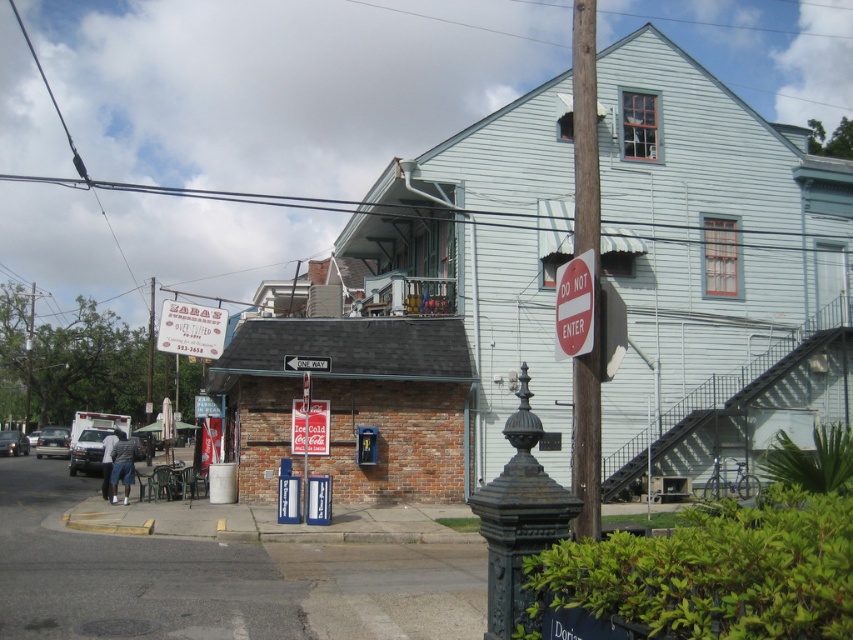
Question: Which of the following is the closest to the observer?

Choices:
 (A) (192, 349)
 (B) (572, 269)
 (C) (577, 529)
 (D) (90, 435)

Answer: (C)

Question: Which object is farther from the camera taking this photo?

Choices:
 (A) white matte van at lower left
 (B) white paper sign at center
 (C) red plastic sign at upper right

Answer: (A)

Question: Does white matte van at lower left have a smaller size compared to white plastic one way sign at center?

Choices:
 (A) no
 (B) yes

Answer: (A)

Question: Which point is closer to the camera?

Choices:
 (A) (33, 429)
 (B) (180, 353)

Answer: (B)

Question: From the image, what is the correct spatial relationship of white paper sign at center in relation to metallic silver sign at center?

Choices:
 (A) left
 (B) right

Answer: (A)

Question: Does wooden pole at center appear on the left side of white plastic one way sign at center?

Choices:
 (A) yes
 (B) no

Answer: (B)